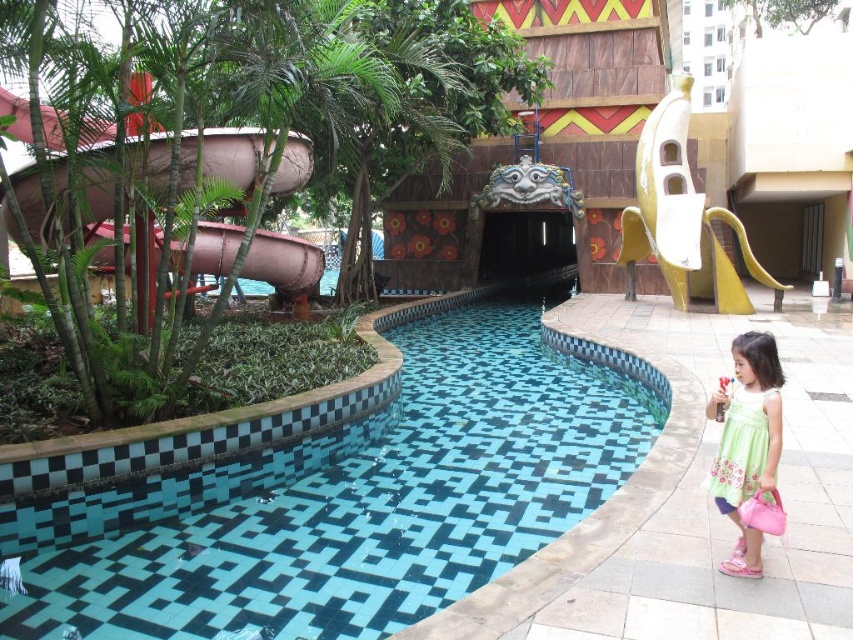
Question: Which point is farther to the camera?

Choices:
 (A) blue mosaic tiles at center
 (B) green floral dress at lower right

Answer: (A)

Question: Which object is closer to the camera taking this photo?

Choices:
 (A) blue mosaic tiles at center
 (B) green floral dress at lower right

Answer: (B)

Question: Is blue mosaic tiles at center further to the viewer compared to green floral dress at lower right?

Choices:
 (A) yes
 (B) no

Answer: (A)

Question: Is blue mosaic tiles at center bigger than green floral dress at lower right?

Choices:
 (A) no
 (B) yes

Answer: (B)

Question: Does blue mosaic tiles at center appear on the right side of green floral dress at lower right?

Choices:
 (A) no
 (B) yes

Answer: (A)